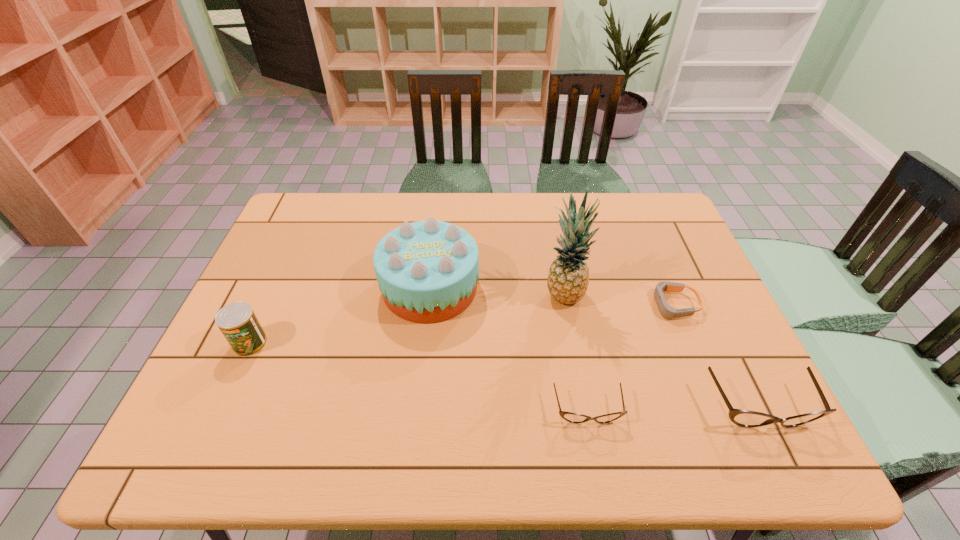
The width and height of the screenshot is (960, 540). In order to click on vacant spot to place a spectacles on the left in this screenshot , I will do `click(414, 413)`.